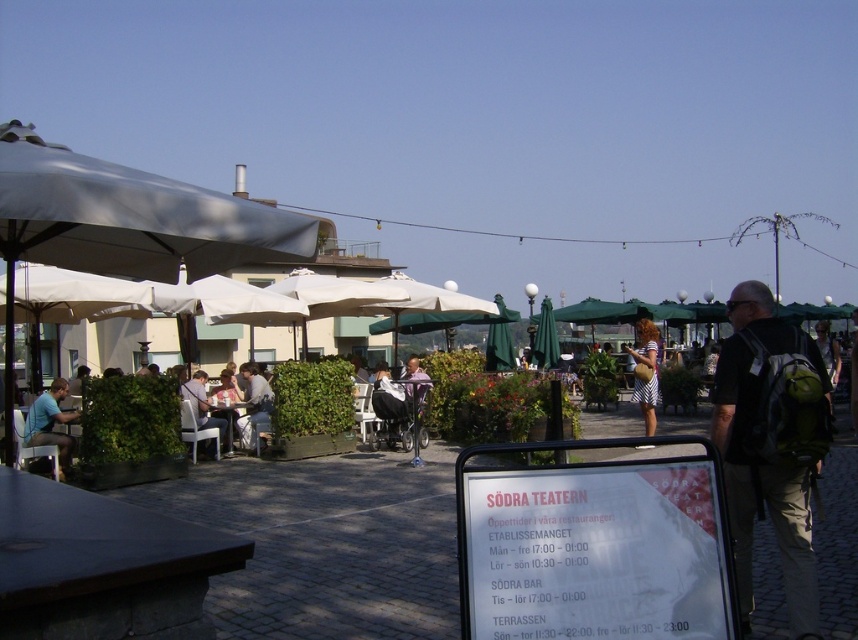
Measure the distance between gray fabric umbrella at upper left and camera.

A distance of 10.13 feet exists between gray fabric umbrella at upper left and camera.

Between gray fabric umbrella at upper left and striped dress at center, which one has more height?

striped dress at center is taller.

Is point (29, 161) behind point (650, 344)?

No, it is in front of (650, 344).

Find the location of a particular element. The width and height of the screenshot is (858, 640). gray fabric umbrella at upper left is located at coordinates (130, 218).

Between dark green backpack at right and striped dress at center, which one is positioned higher?

Positioned higher is striped dress at center.

Does dark green backpack at right lie behind striped dress at center?

That is False.

Does point (816, 637) come in front of point (653, 397)?

Yes, it is in front of point (653, 397).

Locate an element on the screen. This screenshot has width=858, height=640. dark green backpack at right is located at coordinates (760, 449).

At what (x,y) coordinates should I click in order to perform the action: click on gray fabric umbrella at upper left. Please return your answer as a coordinate pair (x, y). Looking at the image, I should click on (130, 218).

Does gray fabric umbrella at upper left have a greater width compared to matte gray shirt at center?

Correct, the width of gray fabric umbrella at upper left exceeds that of matte gray shirt at center.

At what (x,y) coordinates should I click in order to perform the action: click on gray fabric umbrella at upper left. Please return your answer as a coordinate pair (x, y). Image resolution: width=858 pixels, height=640 pixels. Looking at the image, I should click on (130, 218).